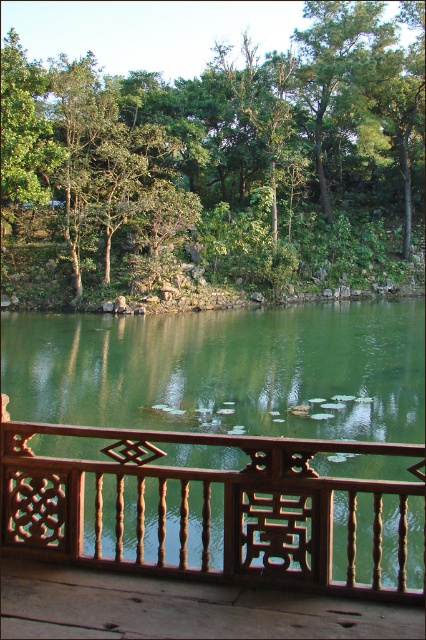
Between point (325, 58) and point (377, 604), which one is positioned behind?

Positioned behind is point (325, 58).

Does green leafy tree at center have a larger size compared to wooden at lower center?

Indeed, green leafy tree at center has a larger size compared to wooden at lower center.

What do you see at coordinates (218, 161) in the screenshot?
I see `green leafy tree at center` at bounding box center [218, 161].

Where is `green leafy tree at center`? green leafy tree at center is located at coordinates (218, 161).

Describe the element at coordinates (213, 508) in the screenshot. This screenshot has height=640, width=426. I see `brown wood balcony at center` at that location.

Between point (193, 440) and point (114, 595), which one is positioned behind?

Point (193, 440)

Locate an element on the screen. brown wood balcony at center is located at coordinates (213, 508).

Which is above, green leafy tree at center or brown wood balcony at center?

green leafy tree at center is higher up.

Between green leafy tree at center and brown wood balcony at center, which one has more height?

Standing taller between the two is green leafy tree at center.

Identify the location of green leafy tree at center. Image resolution: width=426 pixels, height=640 pixels. (218, 161).